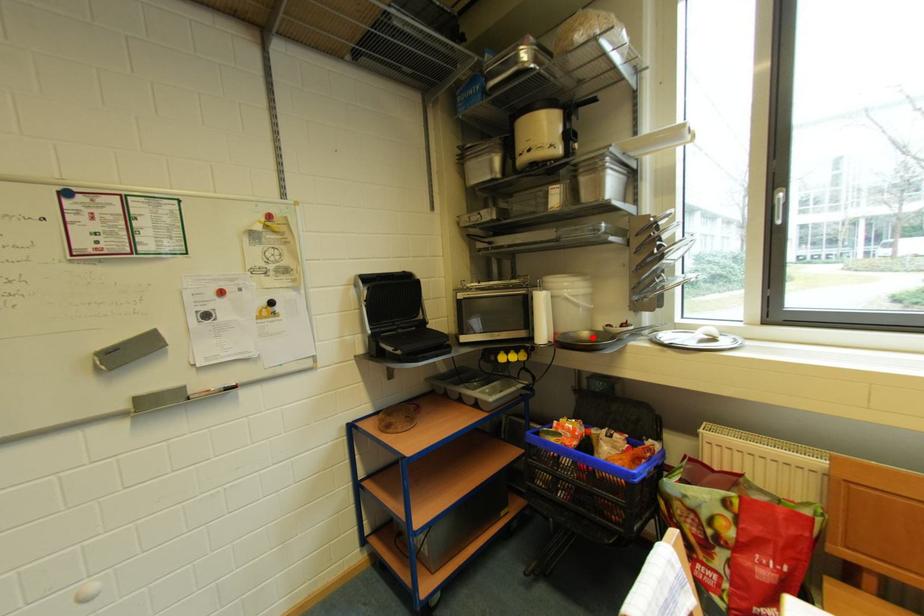
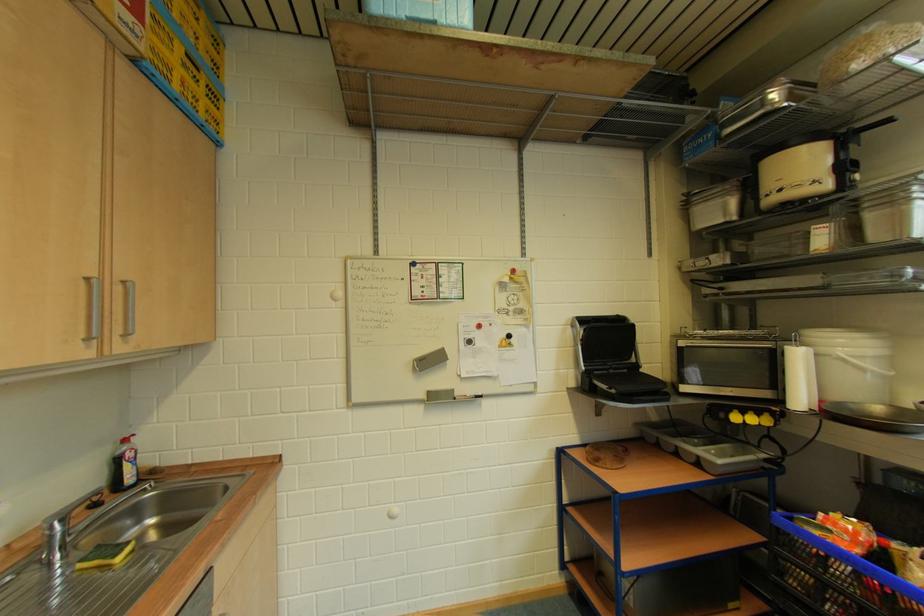
Locate, in the second image, the point that corresponds to the highlighted location in the first image.

(884, 411)